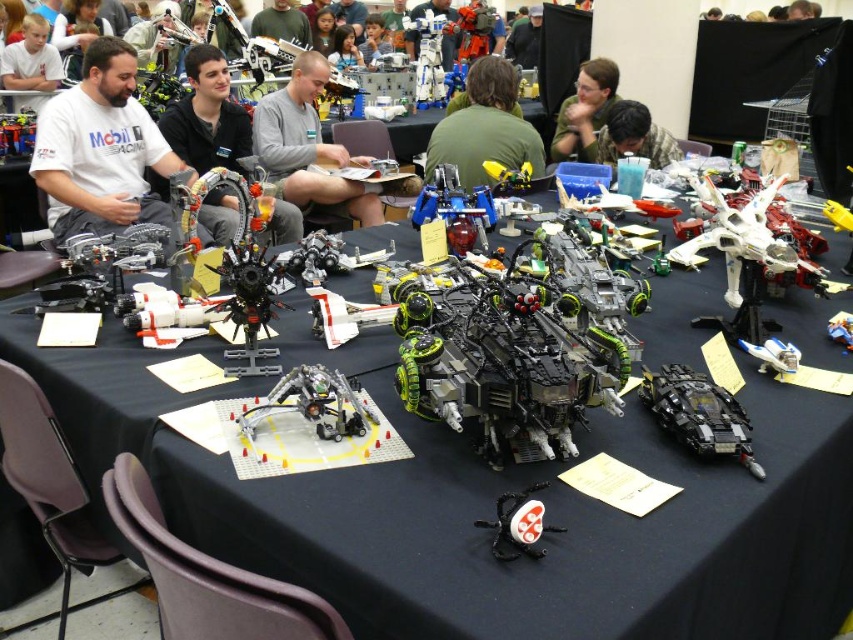
Question: Based on their relative distances, which object is nearer to the black fabric shirt at upper center?

Choices:
 (A) gray matte shirt at center
 (B) green matte shirt at upper center

Answer: (B)

Question: Which is farther from the matte black toy at upper left?

Choices:
 (A) gray matte shirt at center
 (B) black plastic spider at center
 (C) shiny metallic engine at center
 (D) white matte shirt at left

Answer: (B)

Question: Observing the image, what is the correct spatial positioning of green matte shirt at upper center in reference to blonde hair boy at upper left?

Choices:
 (A) below
 (B) above

Answer: (A)

Question: Which of the following is the closest to the observer?

Choices:
 (A) (33, 120)
 (B) (265, 93)
 (C) (33, 84)

Answer: (A)

Question: Is matte green shirt at upper center smaller than blue plastic toy at center?

Choices:
 (A) yes
 (B) no

Answer: (B)

Question: Does black plastic table at center appear on the left side of green matte shirt at center?

Choices:
 (A) no
 (B) yes

Answer: (B)